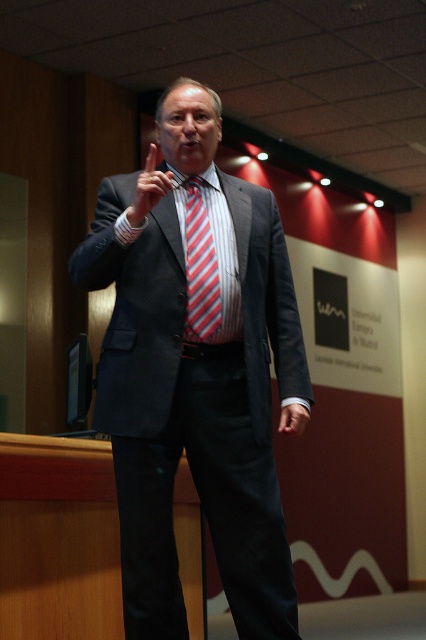
Question: Which of the following is the farthest from the observer?

Choices:
 (A) (209, 230)
 (B) (160, 298)

Answer: (A)

Question: Does matte black suit at center have a greater width compared to matte red tie at center?

Choices:
 (A) no
 (B) yes

Answer: (B)

Question: Which of these objects is positioned closest to the matte red tie at center?

Choices:
 (A) striped fabric tie at center
 (B) satin smooth hand at center
 (C) matte black suit at center

Answer: (A)

Question: Considering the relative positions of matte black suit at center and satin smooth hand at center in the image provided, where is matte black suit at center located with respect to satin smooth hand at center?

Choices:
 (A) left
 (B) right

Answer: (A)

Question: Is matte black suit at center to the left of satin smooth hand at center from the viewer's perspective?

Choices:
 (A) yes
 (B) no

Answer: (A)

Question: Which point is closer to the camera taking this photo?

Choices:
 (A) (154, 156)
 (B) (258, 192)
 (C) (281, 428)

Answer: (A)